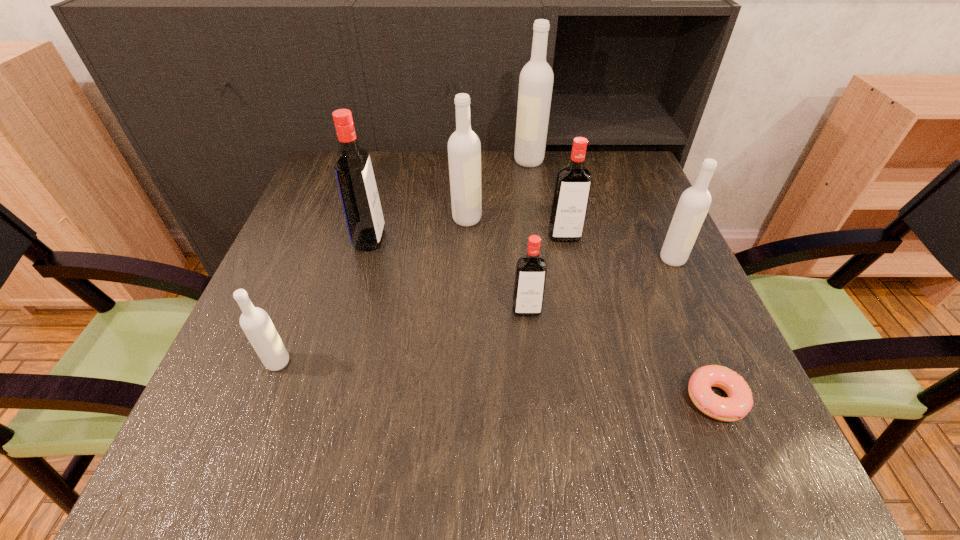
Find the location of a particular element. Image resolution: width=960 pixels, height=540 pixels. vacant position in the image that satisfies the following two spatial constraints: 1. on the front side of the nearest object; 2. on the left side of the leftmost vodka is located at coordinates (264, 398).

The width and height of the screenshot is (960, 540). Find the location of `blank area in the image that satisfies the following two spatial constraints: 1. on the front and back of the rightmost red vodka; 2. on the left side of the nearest object`. blank area in the image that satisfies the following two spatial constraints: 1. on the front and back of the rightmost red vodka; 2. on the left side of the nearest object is located at coordinates (599, 398).

Identify the location of free space that satisfies the following two spatial constraints: 1. on the back side of the doughnut; 2. on the front and back of the biggest red vodka. (649, 239).

The image size is (960, 540). What are the coordinates of `free region that satisfies the following two spatial constraints: 1. on the front and back of the rightmost red vodka; 2. on the front and back of the seventh object from right to left` in the screenshot? It's located at (565, 239).